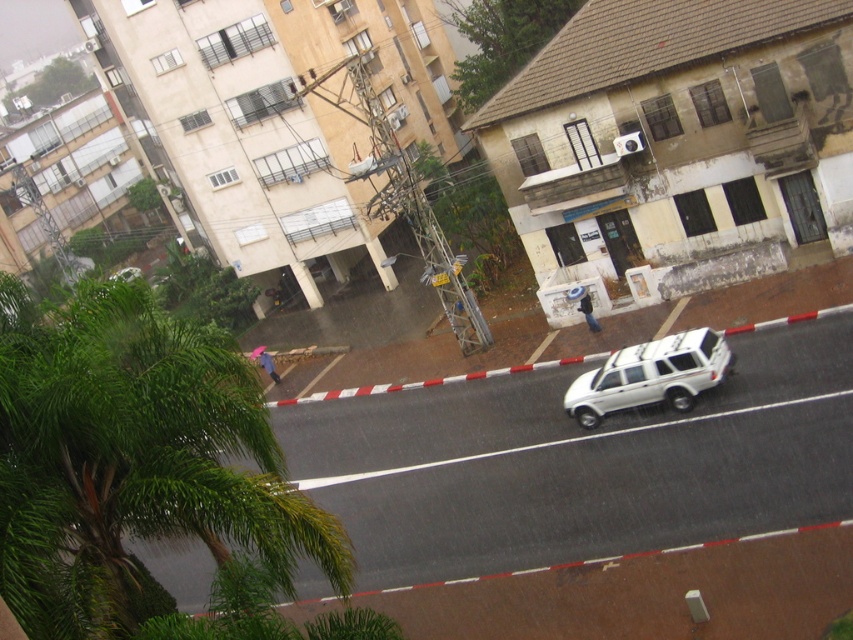
You are standing on the balcony of the building on the left and want to take a photo of the white matte suv at center. Based on its position, where should you aim your camera to capture it in the frame?

You should aim your camera at the point with coordinates (579, 464) to capture the white matte suv at center in the frame.